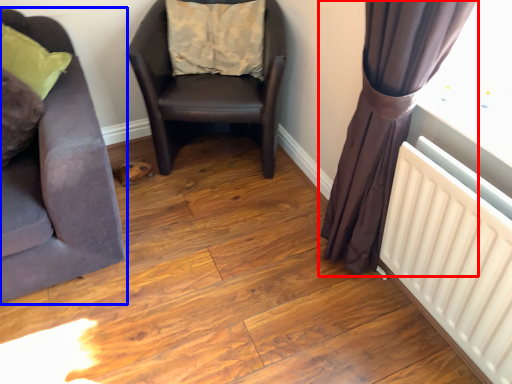
Question: Which object is further to the camera taking this photo, curtain (highlighted by a red box) or chair (highlighted by a blue box)?

Choices:
 (A) curtain
 (B) chair

Answer: (B)